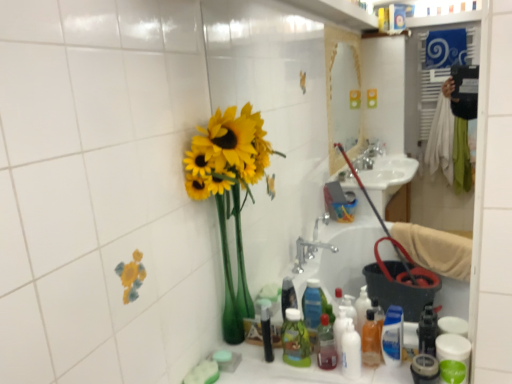
Question: Considering the relative sizes of yellow matte sunflowers at left and translucent orange bottle at lower center, which is the 3th bottle in left-to-right order, in the image provided, is yellow matte sunflowers at left shorter than translucent orange bottle at lower center, which is the 3th bottle in left-to-right order,?

Choices:
 (A) yes
 (B) no

Answer: (B)

Question: Is yellow matte sunflowers at left not near translucent orange bottle at lower center, which is the first bottle from right to left?

Choices:
 (A) yes
 (B) no

Answer: (B)

Question: Can you confirm if yellow matte sunflowers at left is positioned to the right of translucent orange bottle at lower center, which is the 3th bottle in left-to-right order?

Choices:
 (A) no
 (B) yes

Answer: (A)

Question: Does yellow matte sunflowers at left lie behind translucent orange bottle at lower center, which is the 3th bottle in left-to-right order?

Choices:
 (A) no
 (B) yes

Answer: (A)

Question: Is yellow matte sunflowers at left next to translucent orange bottle at lower center, which is the 3th bottle in left-to-right order, and touching it?

Choices:
 (A) yes
 (B) no

Answer: (B)

Question: Is yellow matte sunflowers at left bigger than translucent orange bottle at lower center, which is the 3th bottle in left-to-right order?

Choices:
 (A) yes
 (B) no

Answer: (A)

Question: Considering the relative sizes of green plastic bottle at lower center and yellow matte sunflowers at left in the image provided, is green plastic bottle at lower center taller than yellow matte sunflowers at left?

Choices:
 (A) yes
 (B) no

Answer: (B)

Question: Considering the relative positions of green plastic bottle at lower center and yellow matte sunflowers at left in the image provided, is green plastic bottle at lower center to the left of yellow matte sunflowers at left from the viewer's perspective?

Choices:
 (A) yes
 (B) no

Answer: (B)

Question: Is green plastic bottle at lower center looking in the opposite direction of yellow matte sunflowers at left?

Choices:
 (A) no
 (B) yes

Answer: (A)

Question: Are green plastic bottle at lower center and yellow matte sunflowers at left beside each other?

Choices:
 (A) yes
 (B) no

Answer: (B)

Question: Would you say green plastic bottle at lower center is outside yellow matte sunflowers at left?

Choices:
 (A) no
 (B) yes

Answer: (B)

Question: Is green plastic bottle at lower center facing towards yellow matte sunflowers at left?

Choices:
 (A) yes
 (B) no

Answer: (B)

Question: Does white glossy bottle at lower center, arranged as the 2th cleaning product when viewed from the right, have a lesser width compared to green plastic bottle at lower center?

Choices:
 (A) yes
 (B) no

Answer: (B)